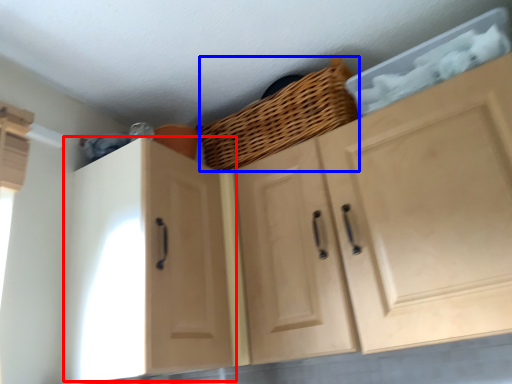
Question: Which of the following is the closest to the observer, cabinetry (highlighted by a red box) or basket (highlighted by a blue box)?

Choices:
 (A) cabinetry
 (B) basket

Answer: (A)